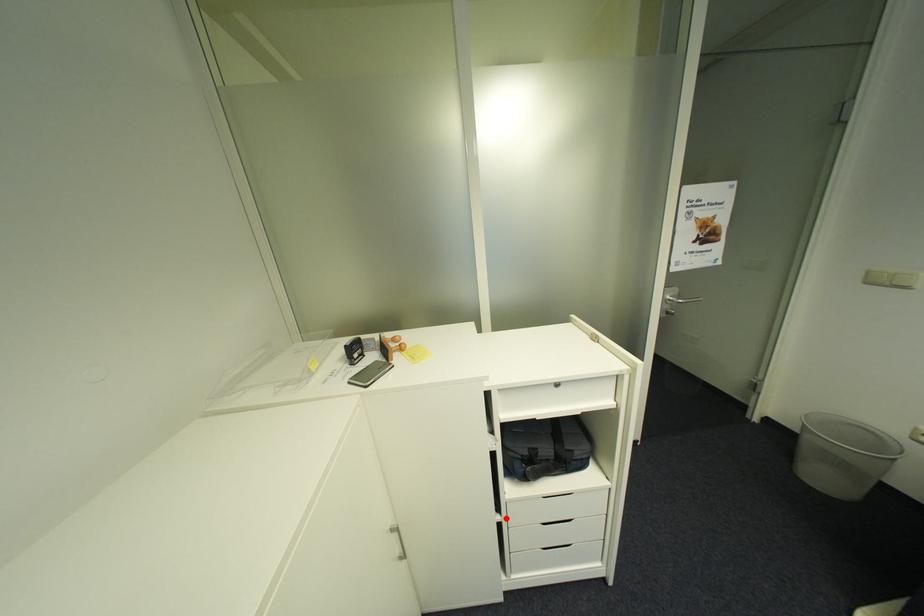
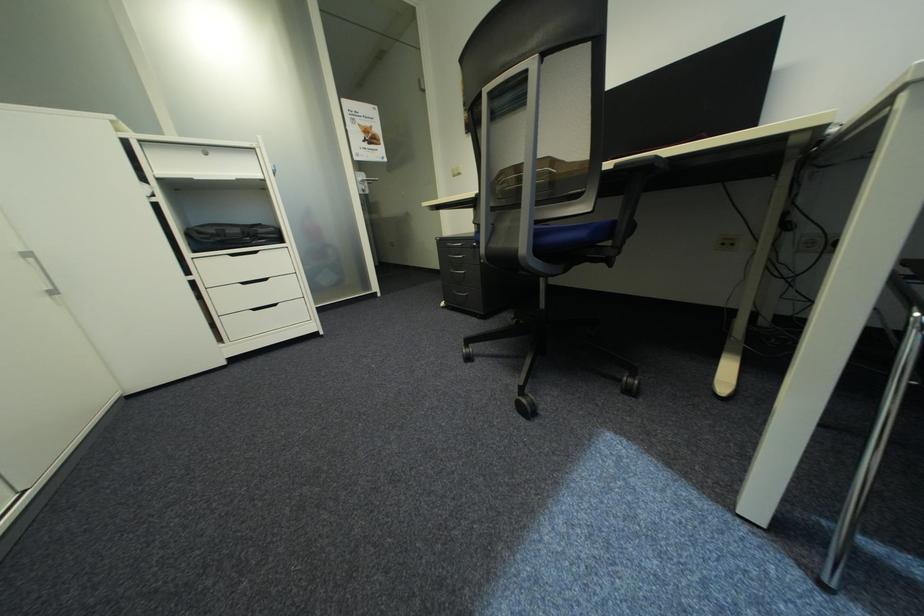
Find the pixel in the second image that matches the highlighted location in the first image.

(199, 278)